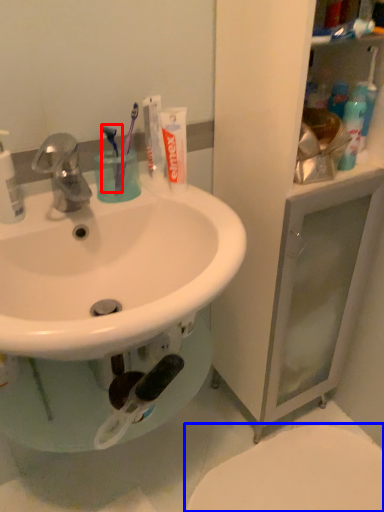
Question: Which of the following is the farthest to the observer, toothbrush (highlighted by a red box) or toilet (highlighted by a blue box)?

Choices:
 (A) toothbrush
 (B) toilet

Answer: (B)